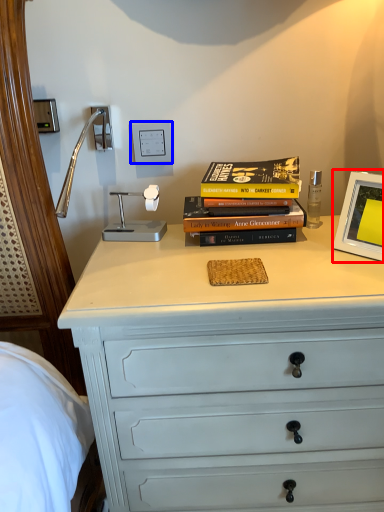
Question: Which object appears closest to the camera in this image, picture frame (highlighted by a red box) or electric outlet (highlighted by a blue box)?

Choices:
 (A) picture frame
 (B) electric outlet

Answer: (A)